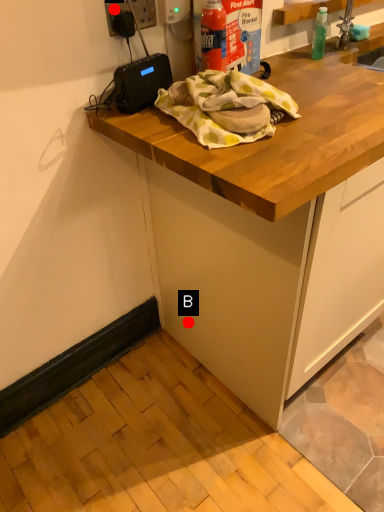
Question: Two points are circled on the image, labeled by A and B beside each circle. Which of the following is the farthest from the observer?

Choices:
 (A) A is further
 (B) B is further

Answer: (B)